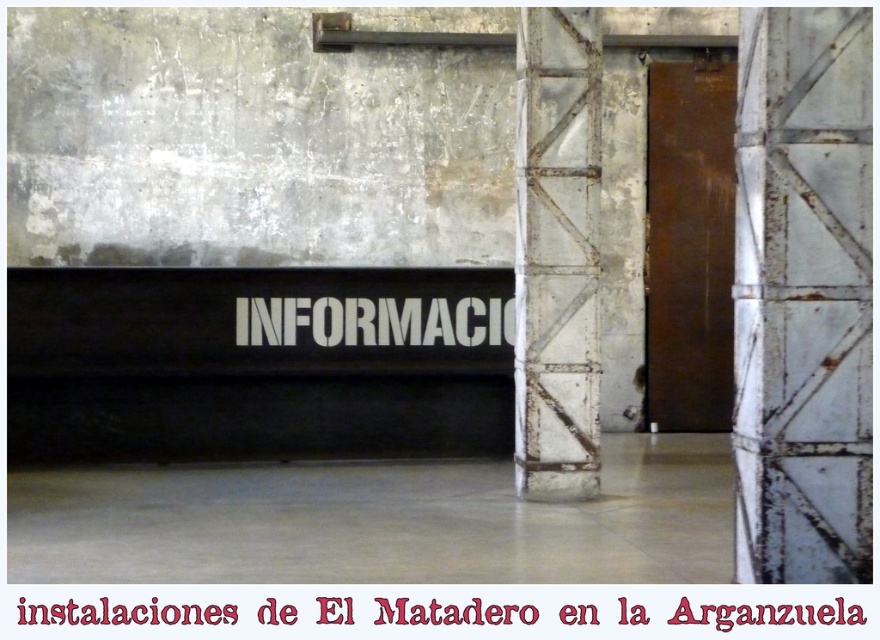
Question: Which object appears closest to the camera in this image?

Choices:
 (A) white plastic sign at center
 (B) white paper text at center

Answer: (B)

Question: Is white painted metal pillar at center right behind white paper text at center?

Choices:
 (A) yes
 (B) no

Answer: (B)

Question: Which object appears farthest from the camera in this image?

Choices:
 (A) rusty metal pillar at center-right
 (B) white plastic sign at center

Answer: (B)

Question: Is white painted metal pillar at center right wider than rusty metal pillar at center-right?

Choices:
 (A) no
 (B) yes

Answer: (A)

Question: Which point is farther to the camera?

Choices:
 (A) rusty metal pillar at center-right
 (B) white paper text at center
 (C) white painted metal pillar at center right

Answer: (A)

Question: Is rusty metal pillar at center-right to the left of white plastic sign at center from the viewer's perspective?

Choices:
 (A) yes
 (B) no

Answer: (B)